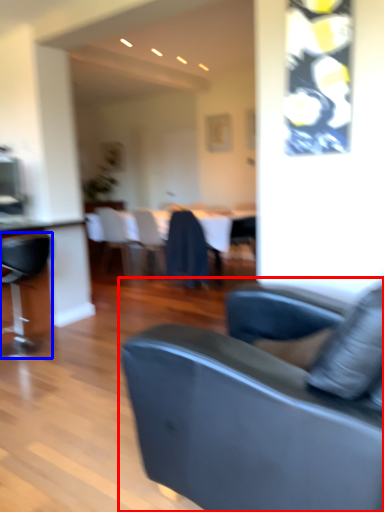
Question: Which object is closer to the camera taking this photo, studio couch (highlighted by a red box) or chair (highlighted by a blue box)?

Choices:
 (A) studio couch
 (B) chair

Answer: (A)